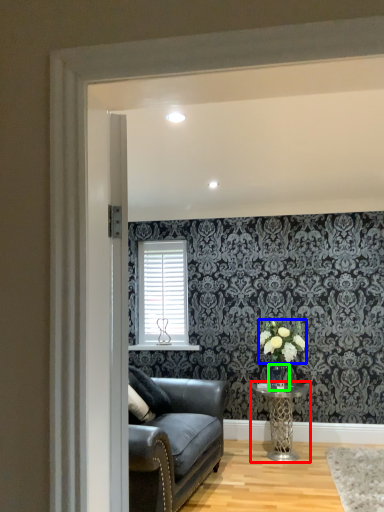
Question: Which is farther away from table (highlighted by a red box)? flower (highlighted by a blue box) or glass vase (highlighted by a green box)?

Choices:
 (A) flower
 (B) glass vase

Answer: (A)